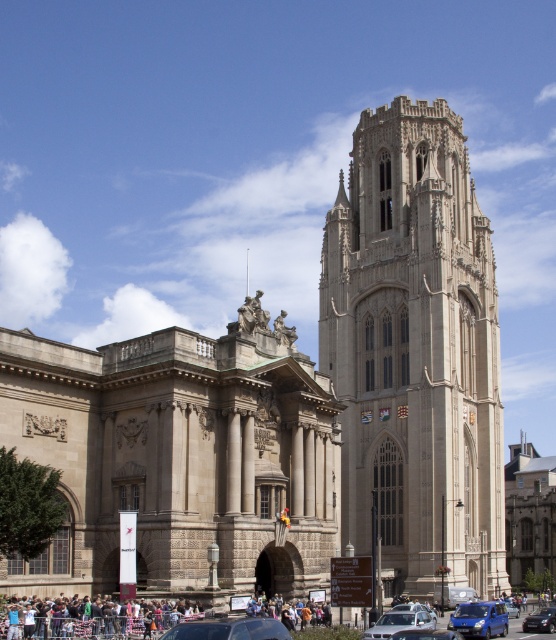
Which of these two, silver metallic car at lower center or blue metallic van at lower center, stands shorter?

Standing shorter between the two is silver metallic car at lower center.

Is silver metallic car at lower center closer to the viewer compared to blue metallic van at lower center?

Yes, silver metallic car at lower center is closer to the viewer.

Which is in front, point (381, 632) or point (509, 602)?

Positioned in front is point (381, 632).

Where is `silver metallic car at lower center`? This screenshot has height=640, width=556. silver metallic car at lower center is located at coordinates (399, 621).

Is metallic silver car at lower center to the right of silver metallic car at lower center from the viewer's perspective?

Incorrect, metallic silver car at lower center is not on the right side of silver metallic car at lower center.

Between metallic silver car at lower center and silver metallic car at lower center, which one has less height?

metallic silver car at lower center is shorter.

The height and width of the screenshot is (640, 556). I want to click on metallic silver car at lower center, so click(x=230, y=630).

Is silver metallic car at lower center shorter than metallic blue sedan at lower right?

Yes.

Is silver metallic car at lower center to the left of metallic blue sedan at lower right from the viewer's perspective?

Correct, you'll find silver metallic car at lower center to the left of metallic blue sedan at lower right.

Is point (405, 624) behind point (533, 620)?

No.

Identify the location of silver metallic car at lower center. (399, 621).